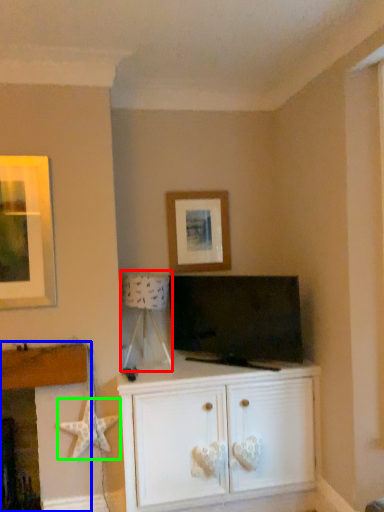
Question: Estimate the real-world distances between objects in this image. Which object is farther from lamp (highlighted by a red box), fireplace (highlighted by a blue box) or starfish (highlighted by a green box)?

Choices:
 (A) fireplace
 (B) starfish

Answer: (B)